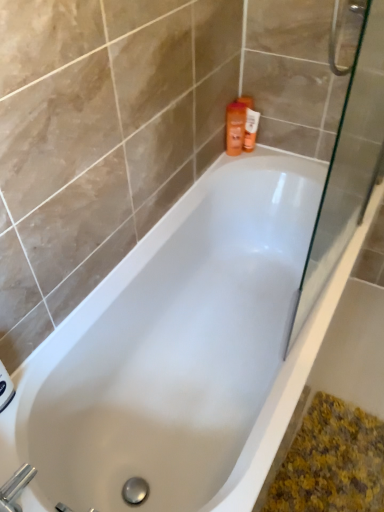
Where is `free space in front of orange plastic bottle at upper right`? This screenshot has height=512, width=384. free space in front of orange plastic bottle at upper right is located at coordinates (257, 161).